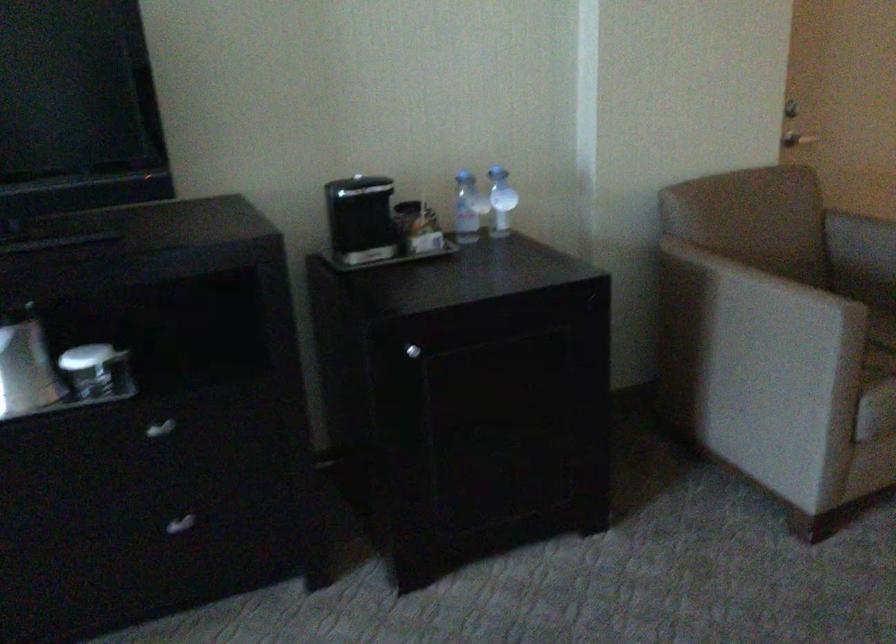
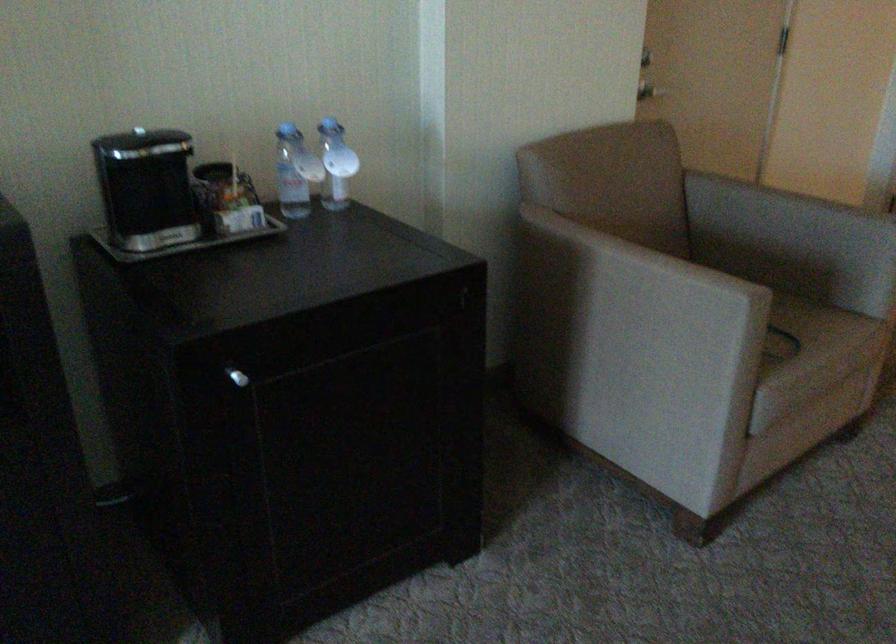
In the second image, find the point that corresponds to (x=360, y=221) in the first image.

(149, 194)